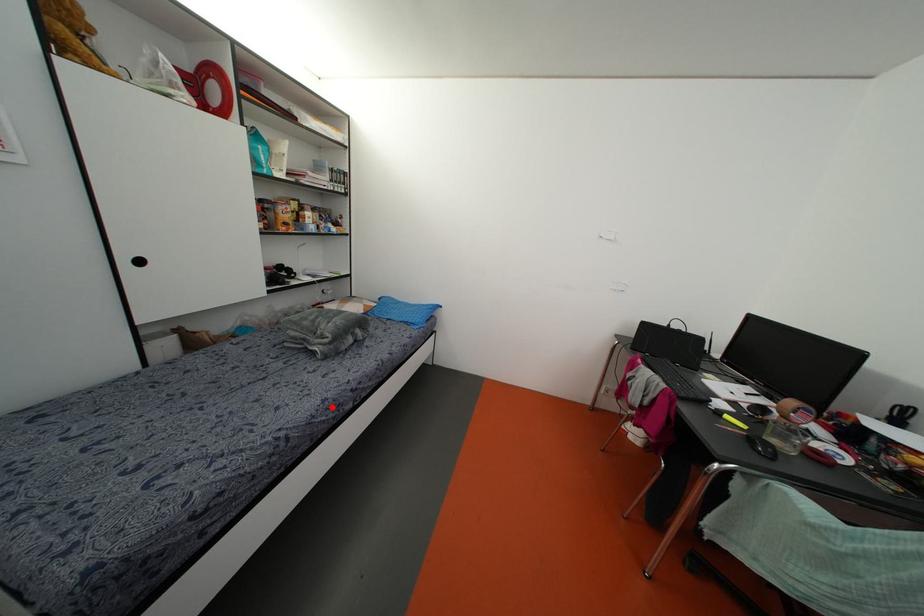
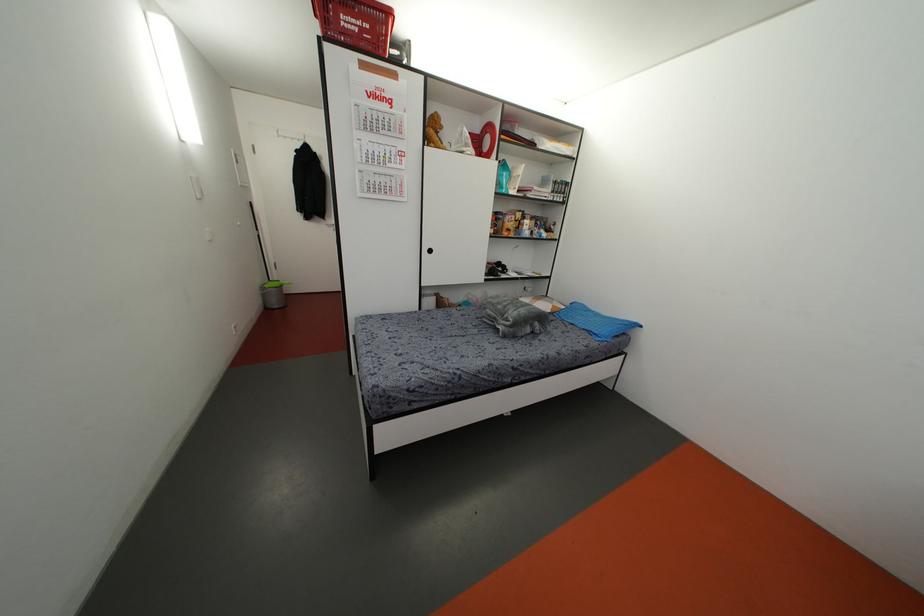
In the second image, find the point that corresponds to the highlighted location in the first image.

(493, 373)